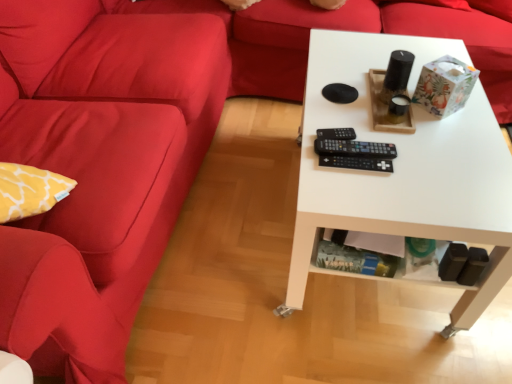
In order to click on vacant space in front of black plastic remote at center, the 3th control in the bottom-to-top sequence in this screenshot , I will do `click(350, 173)`.